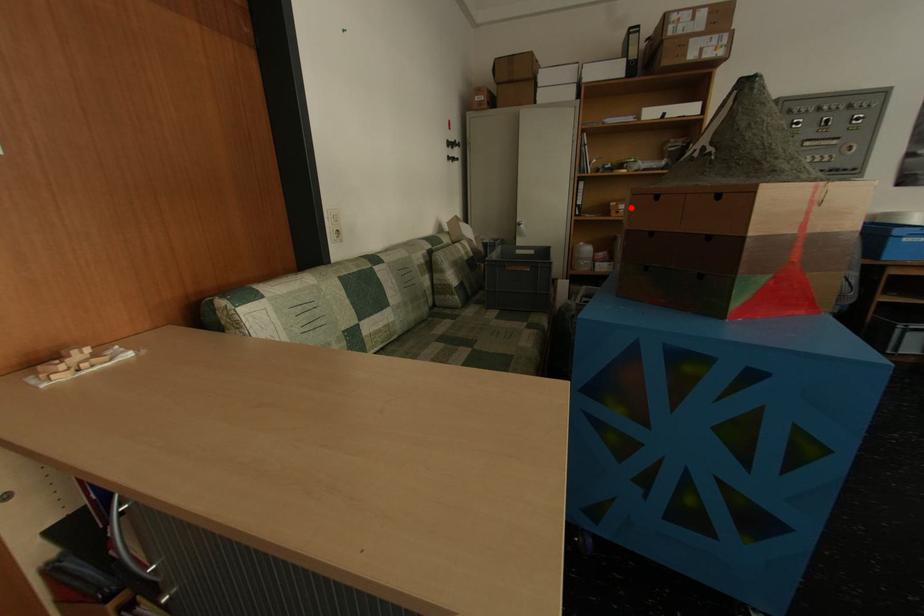
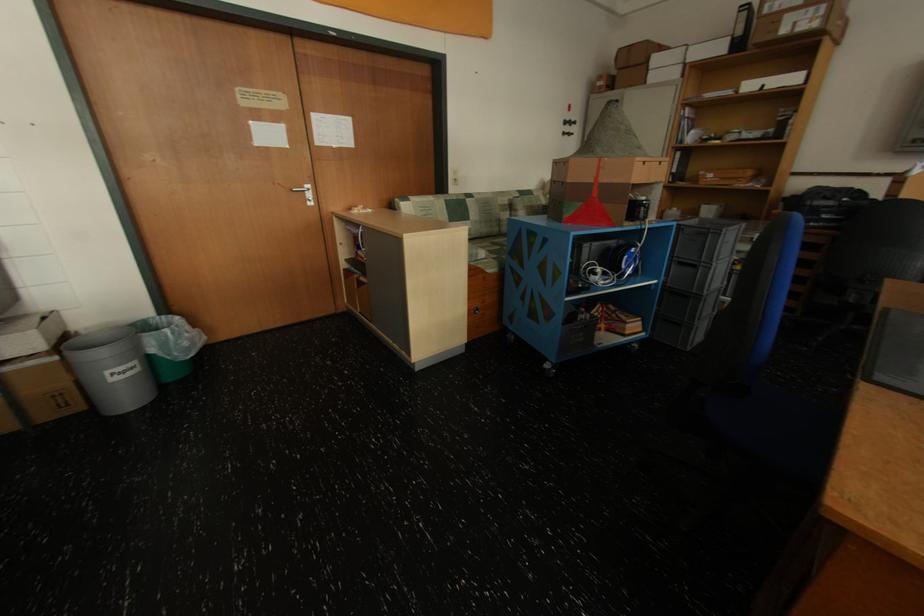
Locate, in the second image, the point that corresponds to the highlighted location in the first image.

(719, 177)